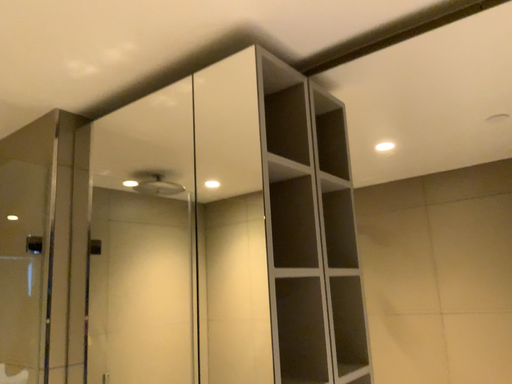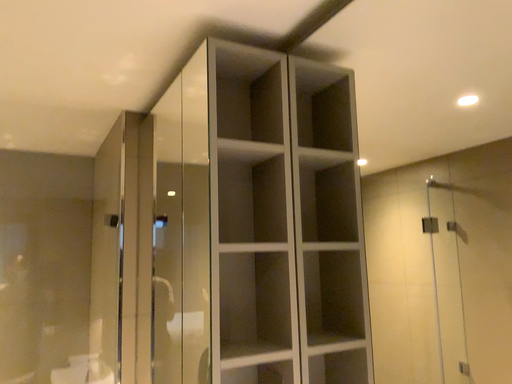
Question: How did the camera likely rotate when shooting the video?

Choices:
 (A) rotated left
 (B) rotated right

Answer: (A)